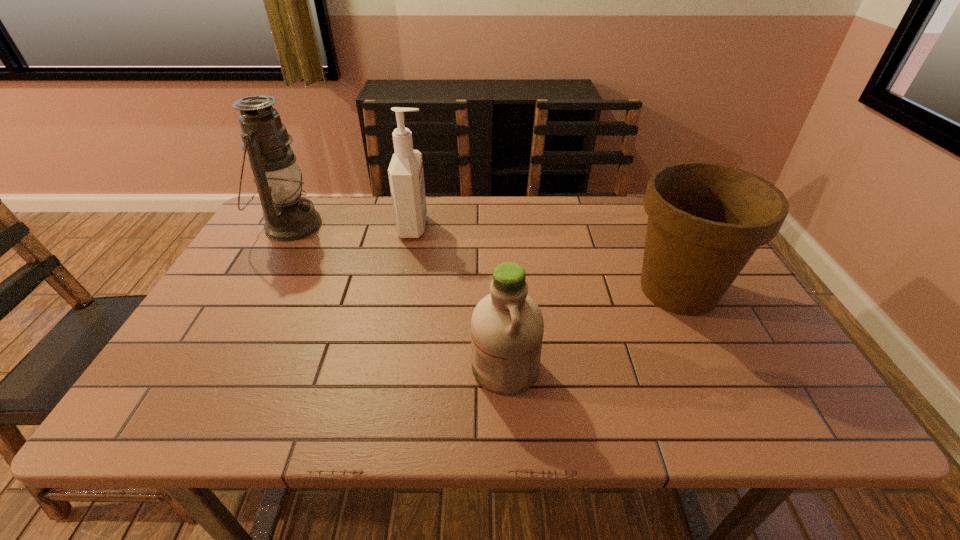
The width and height of the screenshot is (960, 540). In order to click on the leftmost object in this screenshot , I will do `click(288, 217)`.

Identify the location of the third object from right to left. (406, 177).

Locate an element on the screen. The width and height of the screenshot is (960, 540). the left cleansing agent is located at coordinates (406, 177).

Locate an element on the screen. This screenshot has height=540, width=960. the rightmost object is located at coordinates (705, 220).

I want to click on flowerpot, so click(x=705, y=220).

Find the location of `the right cleansing agent`. the right cleansing agent is located at coordinates (507, 326).

Where is `the nearest object`? The width and height of the screenshot is (960, 540). the nearest object is located at coordinates (507, 326).

You are a GUI agent. You are given a task and a screenshot of the screen. Output one action in this format:
    pyautogui.click(x=<x>, y=<y>)
    Task: Click on the free space located on the right of the oil lamp
    This screenshot has width=960, height=540.
    Given the screenshot: What is the action you would take?
    pyautogui.click(x=433, y=225)

Find the location of `vacant space located 0.270m on the front label of the left cleansing agent`. vacant space located 0.270m on the front label of the left cleansing agent is located at coordinates (518, 227).

This screenshot has width=960, height=540. I want to click on vacant area located 0.070m on the left of the rightmost object, so click(596, 290).